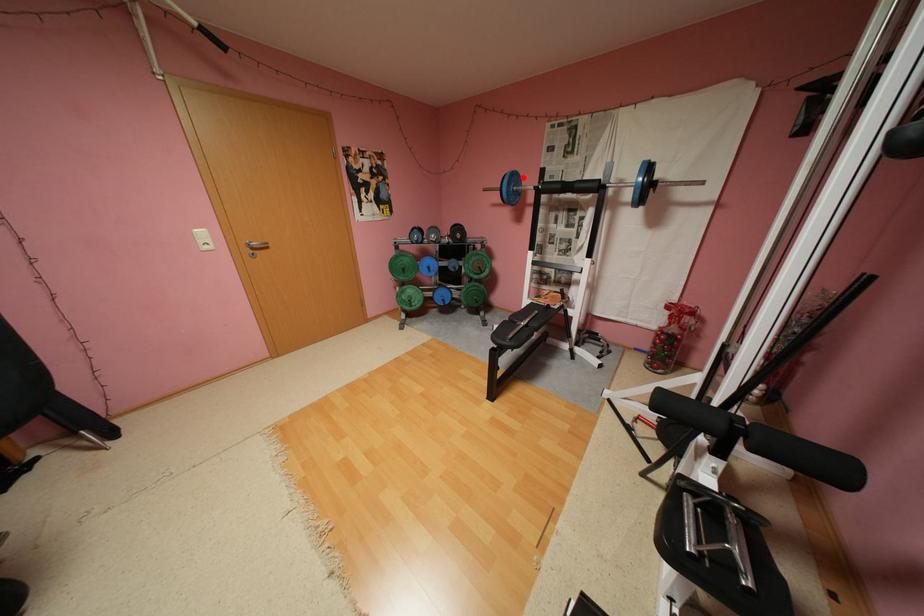
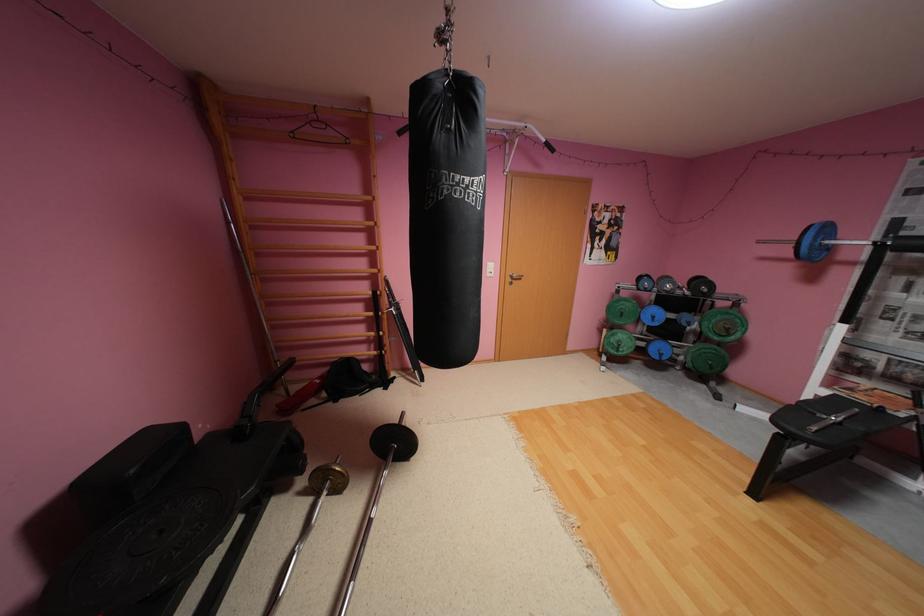
Locate, in the second image, the point that corresponds to the highlighted location in the first image.

(835, 229)